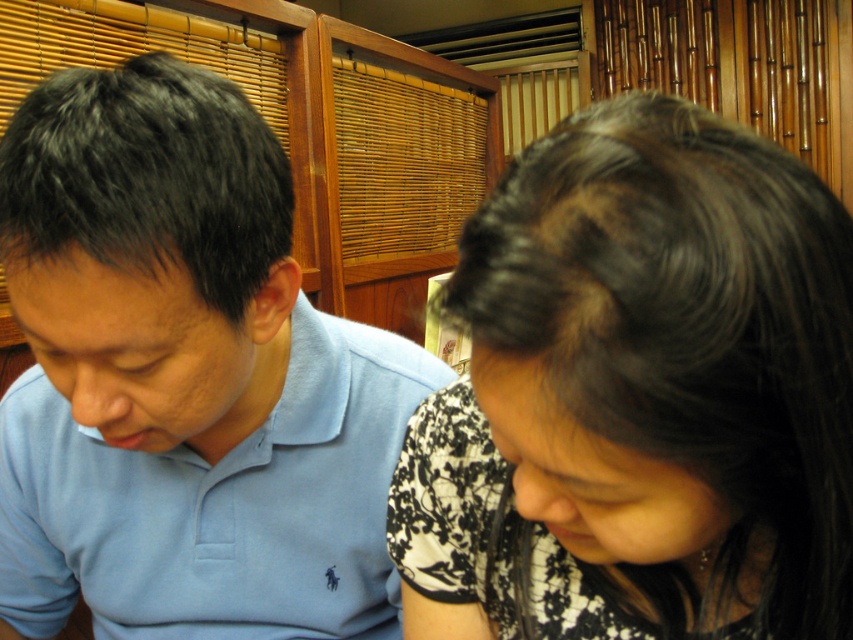
Question: Which point appears farthest from the camera in this image?

Choices:
 (A) (331, 602)
 (B) (624, 307)

Answer: (A)

Question: Which object appears farthest from the camera in this image?

Choices:
 (A) black floral shirt at upper right
 (B) light blue cotton polo shirt at left

Answer: (B)

Question: Can you confirm if black floral shirt at upper right is positioned above light blue cotton polo shirt at left?

Choices:
 (A) no
 (B) yes

Answer: (A)

Question: Can you confirm if black floral shirt at upper right is smaller than light blue cotton polo shirt at left?

Choices:
 (A) yes
 (B) no

Answer: (A)

Question: Is black floral shirt at upper right above light blue cotton polo shirt at left?

Choices:
 (A) yes
 (B) no

Answer: (B)